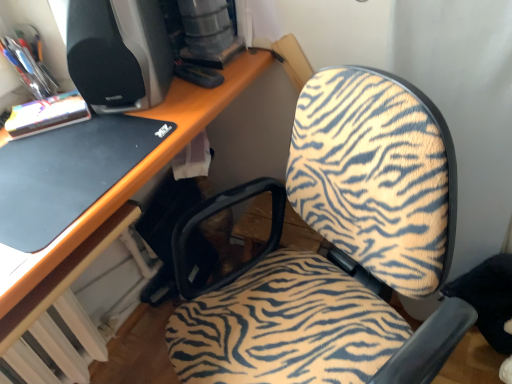
What do you see at coordinates (67, 174) in the screenshot? I see `black matte laptop at left` at bounding box center [67, 174].

Measure the distance between point (x=56, y=164) and camera.

Point (x=56, y=164) is 35.55 inches from camera.

Measure the distance between black plastic desktop computer at upper left and camera.

black plastic desktop computer at upper left is 35.70 inches from camera.

Locate an element on the screen. black matte laptop at left is located at coordinates (67, 174).

From a real-world perspective, between zebra-patterned fabric chair at center and black plastic desktop computer at upper left, who is vertically higher?

In real-world perspective, black plastic desktop computer at upper left is above.

From the picture: From the image's perspective, which one is positioned higher, zebra-patterned fabric chair at center or black plastic desktop computer at upper left?

black plastic desktop computer at upper left is shown above in the image.

Choose the correct answer: Is zebra-patterned fabric chair at center inside black plastic desktop computer at upper left or outside it?

zebra-patterned fabric chair at center is not enclosed by black plastic desktop computer at upper left.

Does black matte laptop at left come behind black plastic desktop computer at upper left?

No, the depth of black matte laptop at left is less than that of black plastic desktop computer at upper left.

Which point is more forward, (60,182) or (153,88)?

The point (60,182) is closer to the camera.

Between black matte laptop at left and black plastic desktop computer at upper left, which one has smaller width?

black plastic desktop computer at upper left is thinner.

Could you tell me if black matte laptop at left is turned towards black plastic desktop computer at upper left?

No, black matte laptop at left is not facing towards black plastic desktop computer at upper left.

Is black plastic desktop computer at upper left oriented away from black matte laptop at left?

No, black plastic desktop computer at upper left is not facing the opposite direction of black matte laptop at left.

In terms of width, does black plastic desktop computer at upper left look wider or thinner when compared to black matte laptop at left?

Considering their sizes, black plastic desktop computer at upper left looks slimmer than black matte laptop at left.

Can you see black plastic desktop computer at upper left touching black matte laptop at left?

No, black plastic desktop computer at upper left is not in contact with black matte laptop at left.

You are a GUI agent. You are given a task and a screenshot of the screen. Output one action in this format:
    pyautogui.click(x=<x>, y=<y>)
    Task: Click on the desktop computer behind the black matte laptop at left
    
    Given the screenshot: What is the action you would take?
    pyautogui.click(x=118, y=53)

In the scene shown: Considering the relative positions of black plastic desktop computer at upper left and zebra-patterned fabric chair at center in the image provided, is black plastic desktop computer at upper left in front of zebra-patterned fabric chair at center?

No, it is not.

Between black plastic desktop computer at upper left and zebra-patterned fabric chair at center, which one has less height?

black plastic desktop computer at upper left is shorter.

From a real-world perspective, between black plastic desktop computer at upper left and zebra-patterned fabric chair at center, who is vertically higher?

black plastic desktop computer at upper left, from a real-world perspective.

In the image, there is a black matte laptop at left. Where is `furniture below it (from the image's perspective)`? The height and width of the screenshot is (384, 512). furniture below it (from the image's perspective) is located at coordinates (366, 178).

From the image's perspective, is zebra-patterned fabric chair at center located above or below black matte laptop at left?

Clearly, from the image's perspective, zebra-patterned fabric chair at center is below black matte laptop at left.

Who is smaller, zebra-patterned fabric chair at center or black matte laptop at left?

With smaller size is black matte laptop at left.

Looking at this image, can you see zebra-patterned fabric chair at center touching black matte laptop at left?

zebra-patterned fabric chair at center and black matte laptop at left are not in contact.

Can you confirm if black matte laptop at left is shorter than zebra-patterned fabric chair at center?

Indeed, black matte laptop at left has a lesser height compared to zebra-patterned fabric chair at center.

Is black matte laptop at left outside of zebra-patterned fabric chair at center?

black matte laptop at left is positioned outside zebra-patterned fabric chair at center.

Is black matte laptop at left at the right side of zebra-patterned fabric chair at center?

Incorrect, black matte laptop at left is not on the right side of zebra-patterned fabric chair at center.

From the image's perspective, is black matte laptop at left above zebra-patterned fabric chair at center?

Indeed, from the image's perspective, black matte laptop at left is shown above zebra-patterned fabric chair at center.

At what (x,y) coordinates should I click in order to perform the action: click on furniture in front of the black plastic desktop computer at upper left. Please return your answer as a coordinate pair (x, y). Looking at the image, I should click on (366, 178).

I want to click on desktop computer above the black matte laptop at left (from a real-world perspective), so click(118, 53).

Based on their spatial positions, is black plastic desktop computer at upper left or zebra-patterned fabric chair at center further from black matte laptop at left?

zebra-patterned fabric chair at center.

Estimate the real-world distances between objects in this image. Which object is further from black matte laptop at left, zebra-patterned fabric chair at center or black plastic desktop computer at upper left?

Based on the image, zebra-patterned fabric chair at center appears to be further to black matte laptop at left.

When comparing their distances from black plastic desktop computer at upper left, does zebra-patterned fabric chair at center or black matte laptop at left seem closer?

The object closer to black plastic desktop computer at upper left is black matte laptop at left.

Looking at this image, estimate the real-world distances between objects in this image. Which object is further from black plastic desktop computer at upper left, black matte laptop at left or zebra-patterned fabric chair at center?

zebra-patterned fabric chair at center lies further to black plastic desktop computer at upper left than the other object.

When comparing their distances from zebra-patterned fabric chair at center, does black plastic desktop computer at upper left or black matte laptop at left seem further?

The object further to zebra-patterned fabric chair at center is black plastic desktop computer at upper left.

When comparing their distances from zebra-patterned fabric chair at center, does black matte laptop at left or black plastic desktop computer at upper left seem further?

black plastic desktop computer at upper left.

The width and height of the screenshot is (512, 384). Find the location of `laptop between black plastic desktop computer at upper left and zebra-patterned fabric chair at center from top to bottom`. laptop between black plastic desktop computer at upper left and zebra-patterned fabric chair at center from top to bottom is located at coordinates (67, 174).